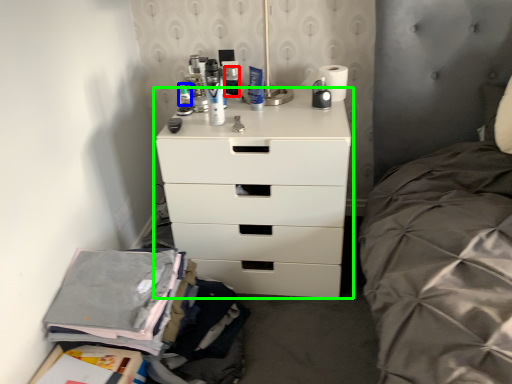
Question: Estimate the real-world distances between objects in this image. Which object is closer to toiletry (highlighted by a red box), toiletry (highlighted by a blue box) or chest of drawers (highlighted by a green box)?

Choices:
 (A) toiletry
 (B) chest of drawers

Answer: (A)